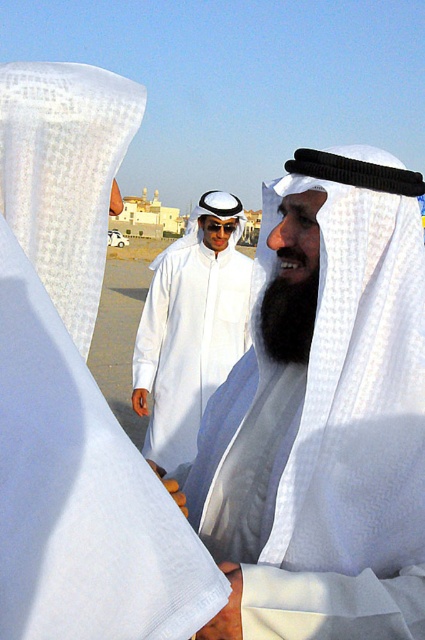
You are a GUI agent. You are given a task and a screenshot of the screen. Output one action in this format:
    pyautogui.click(x=<x>, y=<y>)
    Task: Click on the white matte kandura at center
    
    Given the screenshot: What is the action you would take?
    pyautogui.click(x=190, y=326)

Is white matte kandura at center positioned in front of black fuzzy beard at center?

No.

Is point (141, 348) positioned in front of point (303, 362)?

No, it is behind (303, 362).

Identify the location of white matte kandura at center. The width and height of the screenshot is (425, 640). (190, 326).

Which is more to the left, white textured robe at center or white sheer cloth at upper left?

Positioned to the left is white sheer cloth at upper left.

At what (x,y) coordinates should I click in order to perform the action: click on white textured robe at center. Please return your answer as a coordinate pair (x, y). This screenshot has width=425, height=640. Looking at the image, I should click on (325, 419).

Describe the element at coordinates (325, 419) in the screenshot. I see `white textured robe at center` at that location.

Which is behind, point (323, 353) or point (285, 289)?

Point (285, 289)

Locate an element on the screen. Image resolution: width=425 pixels, height=640 pixels. white textured robe at center is located at coordinates (325, 419).

What are the coordinates of `white textured robe at center` in the screenshot? It's located at (325, 419).